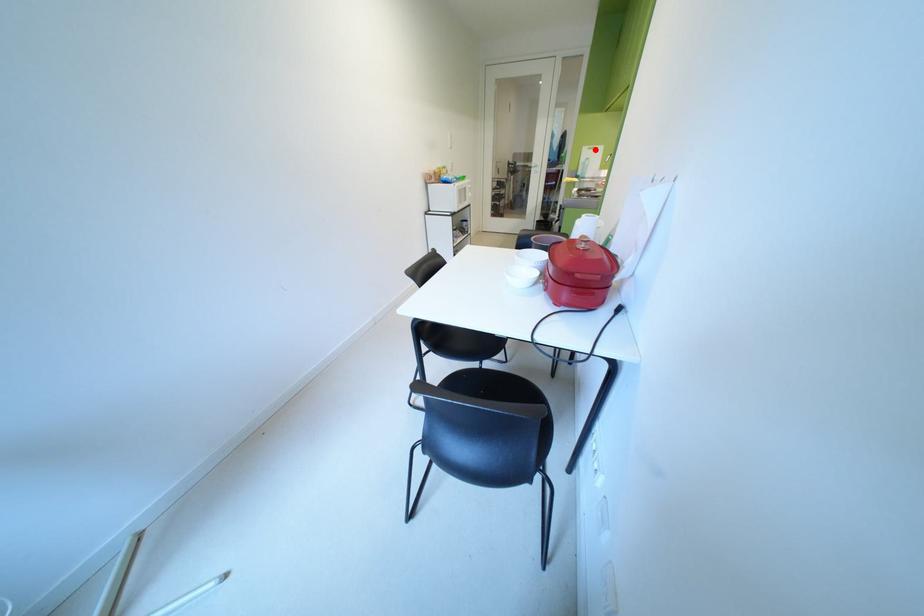
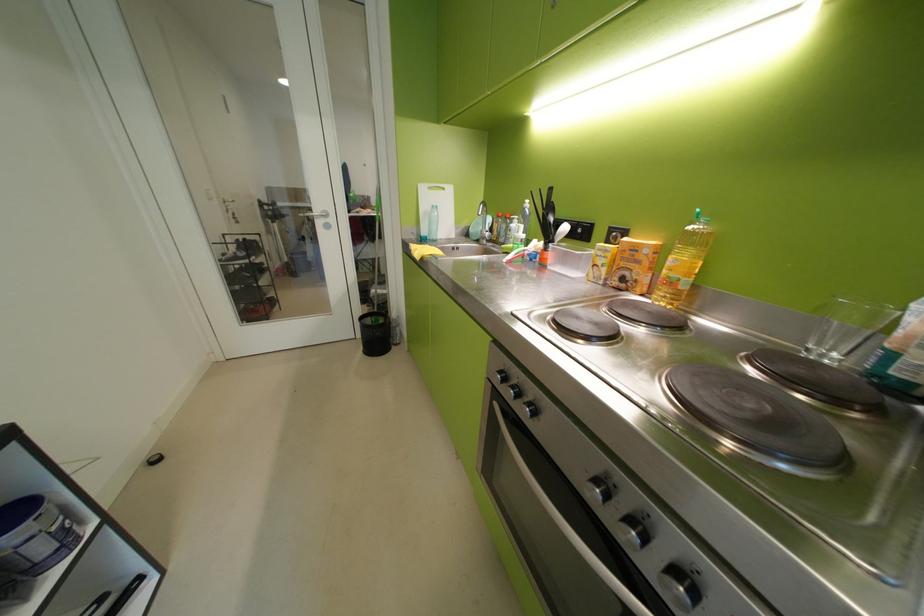
The point at the highlighted location is marked in the first image. Where is the corresponding point in the second image?

(433, 190)